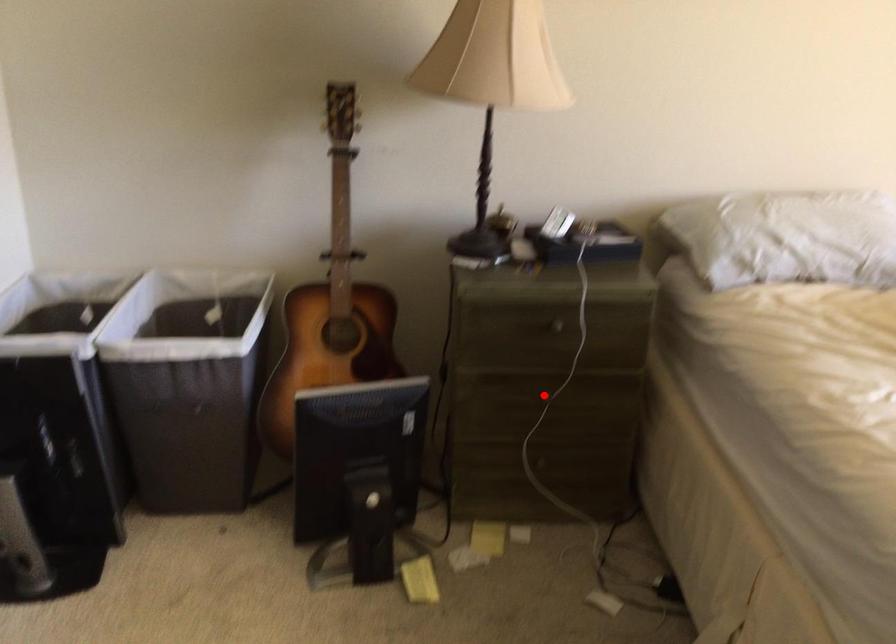
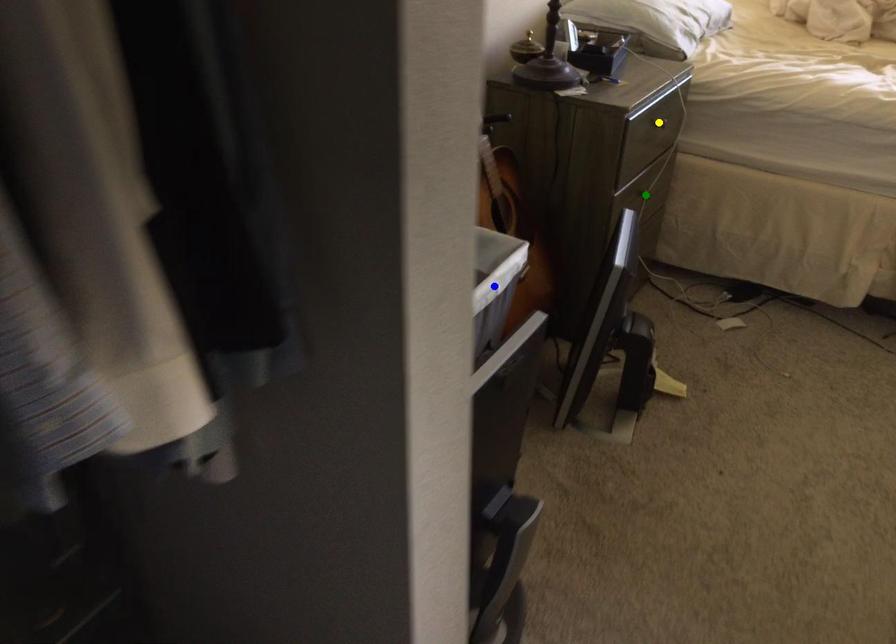
Question: I am providing you with two images of the same scene from different viewpoints. A red point is marked on the first image. You are given multiple points on the second image. Which point in image 2 represents the same 3d spot as the red point in image 1?

Choices:
 (A) yellow point
 (B) green point
 (C) blue point

Answer: (B)